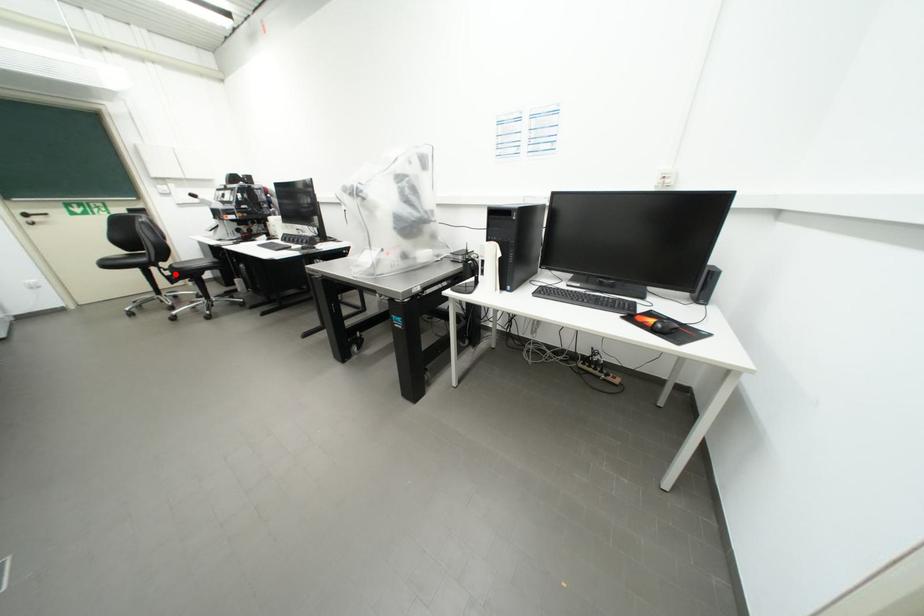
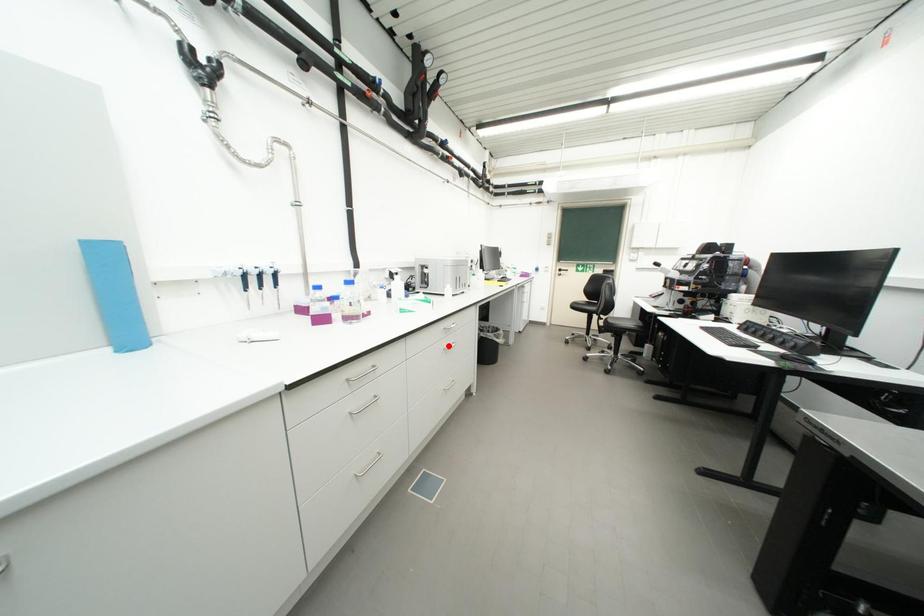
Looking at this image, I am providing you with two images of the same scene from different viewpoints. A red point is marked on the first image and another point is marked on the second image. Are the points marked in image1 and image2 representing the same 3D position?

No